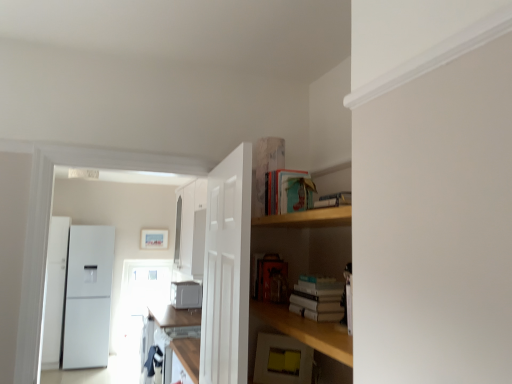
Question: Is teal matte book at upper center, which ranks as the second book in bottom-to-top order, not within white glossy cabinet at upper left, which is counted as the 1th cabinetry, starting from the back?

Choices:
 (A) no
 (B) yes

Answer: (B)

Question: Is teal matte book at upper center, the 1th book viewed from the top, further to camera compared to white glossy cabinet at upper left, which is counted as the second cabinetry, starting from the bottom?

Choices:
 (A) yes
 (B) no

Answer: (B)

Question: From the image's perspective, would you say teal matte book at upper center, the 1th book viewed from the top, is shown under white glossy cabinet at upper left, which is the 2th cabinetry in front-to-back order?

Choices:
 (A) no
 (B) yes

Answer: (A)

Question: Would you say white glossy cabinet at upper left, the first cabinetry viewed from the top, is part of teal matte book at upper center, the 1th book viewed from the top,'s contents?

Choices:
 (A) yes
 (B) no

Answer: (B)

Question: Does teal matte book at upper center, which ranks as the second book in bottom-to-top order, appear on the left side of white glossy cabinet at upper left, which is counted as the 1th cabinetry, starting from the back?

Choices:
 (A) no
 (B) yes

Answer: (A)

Question: Considering the relative sizes of teal matte book at upper center, which ranks as the second book in bottom-to-top order, and white glossy cabinet at upper left, the first cabinetry viewed from the top, in the image provided, is teal matte book at upper center, which ranks as the second book in bottom-to-top order, smaller than white glossy cabinet at upper left, the first cabinetry viewed from the top,?

Choices:
 (A) yes
 (B) no

Answer: (A)

Question: From the image's perspective, would you say matte wooden picture frame at upper center is shown under yellow matte sticky notes at lower center, acting as the 2th appliance starting from the bottom?

Choices:
 (A) no
 (B) yes

Answer: (A)

Question: From a real-world perspective, does matte wooden picture frame at upper center stand above yellow matte sticky notes at lower center, placed as the second appliance when sorted from left to right?

Choices:
 (A) no
 (B) yes

Answer: (B)

Question: Is matte wooden picture frame at upper center looking in the opposite direction of yellow matte sticky notes at lower center, acting as the 2th appliance starting from the bottom?

Choices:
 (A) no
 (B) yes

Answer: (A)

Question: Can you confirm if matte wooden picture frame at upper center is wider than yellow matte sticky notes at lower center, placed as the second appliance when sorted from left to right?

Choices:
 (A) no
 (B) yes

Answer: (A)

Question: Is matte wooden picture frame at upper center not inside yellow matte sticky notes at lower center, arranged as the first appliance when viewed from the right?

Choices:
 (A) no
 (B) yes

Answer: (B)

Question: Is matte wooden picture frame at upper center at the right side of yellow matte sticky notes at lower center, arranged as the first appliance when viewed from the right?

Choices:
 (A) yes
 (B) no

Answer: (B)

Question: Does teal matte book at upper center, the 1th book viewed from the top, appear on the right side of white matte book at center, which is counted as the 2th book, starting from the top?

Choices:
 (A) no
 (B) yes

Answer: (A)